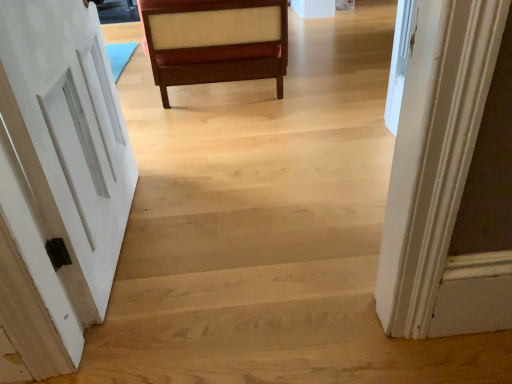
At what (x,y) coordinates should I click in order to perform the action: click on mahogany wood chair at center. Please return your answer as a coordinate pair (x, y). Looking at the image, I should click on (215, 41).

This screenshot has width=512, height=384. Describe the element at coordinates (215, 41) in the screenshot. I see `mahogany wood chair at center` at that location.

You are a GUI agent. You are given a task and a screenshot of the screen. Output one action in this format:
    pyautogui.click(x=<x>, y=<y>)
    Task: Click on the white painted wood door at left
    Image resolution: width=512 pixels, height=384 pixels.
    Given the screenshot: What is the action you would take?
    pyautogui.click(x=69, y=137)

The height and width of the screenshot is (384, 512). What do you see at coordinates (69, 137) in the screenshot?
I see `white painted wood door at left` at bounding box center [69, 137].

In order to click on mahogany wood chair at center in this screenshot , I will do `click(215, 41)`.

Is mahogany wood chair at center to the left or to the right of white painted wood door at left in the image?

Clearly, mahogany wood chair at center is on the right of white painted wood door at left in the image.

Considering their positions, is mahogany wood chair at center located in front of or behind white painted wood door at left?

Clearly, mahogany wood chair at center is behind white painted wood door at left.

Considering the points (170, 24) and (91, 258), which point is behind, point (170, 24) or point (91, 258)?

The point (170, 24) is behind.

From the image's perspective, is mahogany wood chair at center on top of white painted wood door at left?

Yes, from the image's perspective, mahogany wood chair at center is over white painted wood door at left.

From a real-world perspective, is mahogany wood chair at center positioned above or below white painted wood door at left?

In terms of real-world spatial position, mahogany wood chair at center is below white painted wood door at left.

Which of these two, mahogany wood chair at center or white painted wood door at left, is thinner?

With smaller width is white painted wood door at left.

Who is taller, mahogany wood chair at center or white painted wood door at left?

white painted wood door at left.

Based on the photo, which of these two, mahogany wood chair at center or white painted wood door at left, is smaller?

Smaller between the two is white painted wood door at left.

Based on the photo, is mahogany wood chair at center positioned beyond the bounds of white painted wood door at left?

Indeed, mahogany wood chair at center is completely outside white painted wood door at left.

Is mahogany wood chair at center touching white painted wood door at left?

No, mahogany wood chair at center is not making contact with white painted wood door at left.

Is mahogany wood chair at center aimed at white painted wood door at left?

No, mahogany wood chair at center is not oriented towards white painted wood door at left.

Measure the distance from mahogany wood chair at center to white painted wood door at left.

mahogany wood chair at center is 37.70 inches from white painted wood door at left.

Find the location of a particular element. This screenshot has width=512, height=384. door below the mahogany wood chair at center (from the image's perspective) is located at coordinates (69, 137).

Based on the photo, is white painted wood door at left at the right side of mahogany wood chair at center?

In fact, white painted wood door at left is to the left of mahogany wood chair at center.

Is the position of white painted wood door at left more distant than that of mahogany wood chair at center?

No, it is in front of mahogany wood chair at center.

Is point (27, 86) positioned before point (230, 23)?

Yes, point (27, 86) is closer to viewer.

From the image's perspective, which one is positioned lower, white painted wood door at left or mahogany wood chair at center?

white painted wood door at left appears lower in the image.

From a real-world perspective, relative to mahogany wood chair at center, is white painted wood door at left vertically above or below?

In terms of real-world spatial position, white painted wood door at left is above mahogany wood chair at center.

Between white painted wood door at left and mahogany wood chair at center, which one has larger width?

Wider between the two is mahogany wood chair at center.

Considering the sizes of objects white painted wood door at left and mahogany wood chair at center in the image provided, who is taller, white painted wood door at left or mahogany wood chair at center?

With more height is white painted wood door at left.

Who is smaller, white painted wood door at left or mahogany wood chair at center?

With smaller size is white painted wood door at left.

Is mahogany wood chair at center surrounded by white painted wood door at left?

Definitely not — mahogany wood chair at center is not inside white painted wood door at left.

Consider the image. Can you see white painted wood door at left touching mahogany wood chair at center?

white painted wood door at left is not next to mahogany wood chair at center, and they're not touching.

Is white painted wood door at left aimed at mahogany wood chair at center?

No, white painted wood door at left is not aimed at mahogany wood chair at center.

What's the angular difference between white painted wood door at left and mahogany wood chair at center's facing directions?

white painted wood door at left and mahogany wood chair at center are facing 170 degrees away from each other.

How much distance is there between white painted wood door at left and mahogany wood chair at center?

white painted wood door at left and mahogany wood chair at center are 37.70 inches apart.

Identify the location of chair below the white painted wood door at left (from a real-world perspective). The image size is (512, 384). (215, 41).

This screenshot has height=384, width=512. Identify the location of door located in front of the mahogany wood chair at center. (69, 137).

Locate an element on the screen. This screenshot has width=512, height=384. chair beneath the white painted wood door at left (from a real-world perspective) is located at coordinates (215, 41).